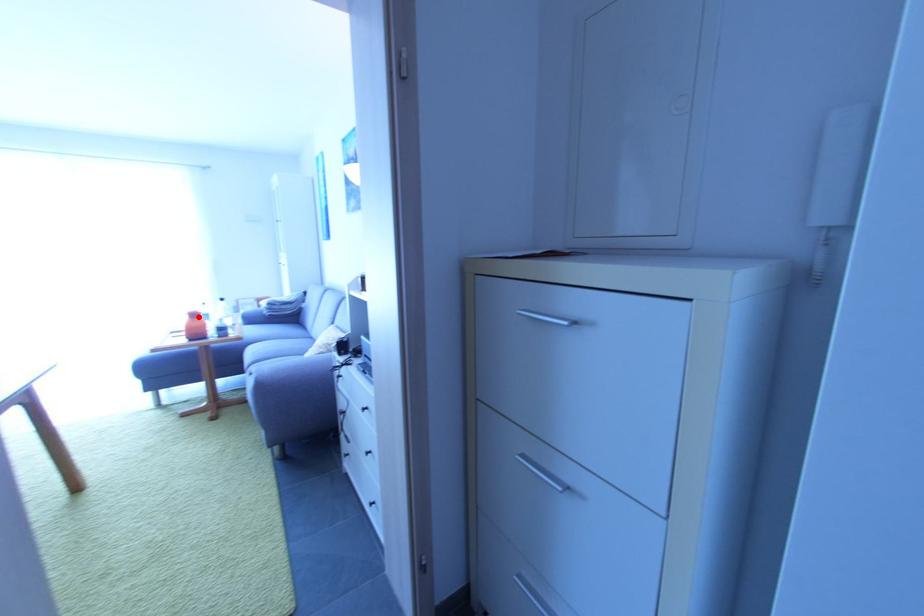
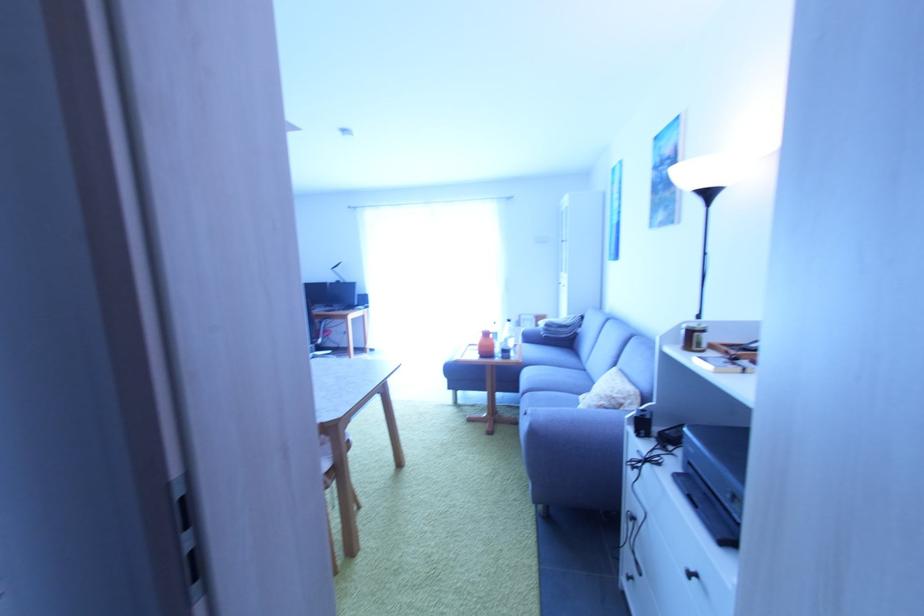
Question: A red point is marked in image1. In image2, is the corresponding 3D point closer to the camera or farther? Reply with the corresponding letter.

Choices:
 (A) The corresponding 3D point is closer.
 (B) The corresponding 3D point is farther.

Answer: (B)